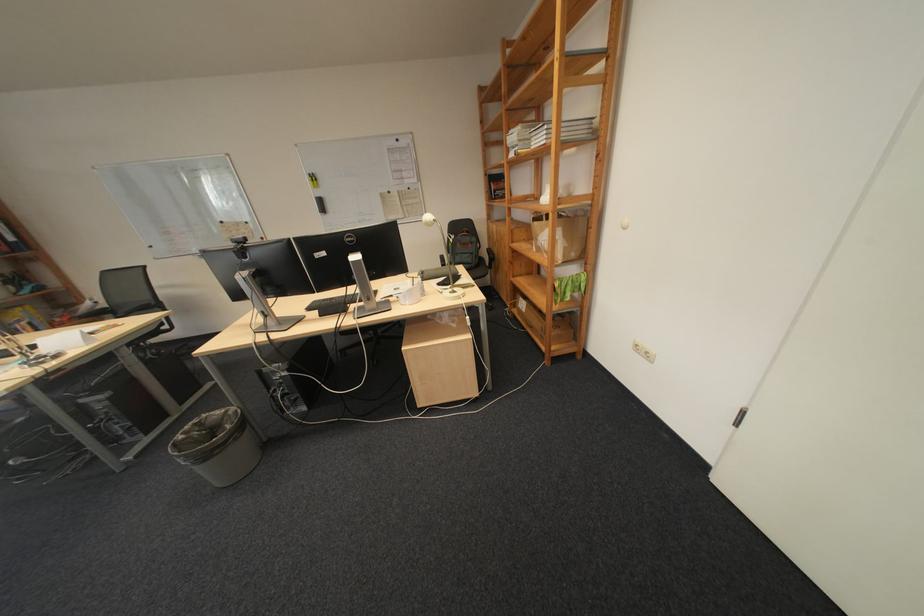
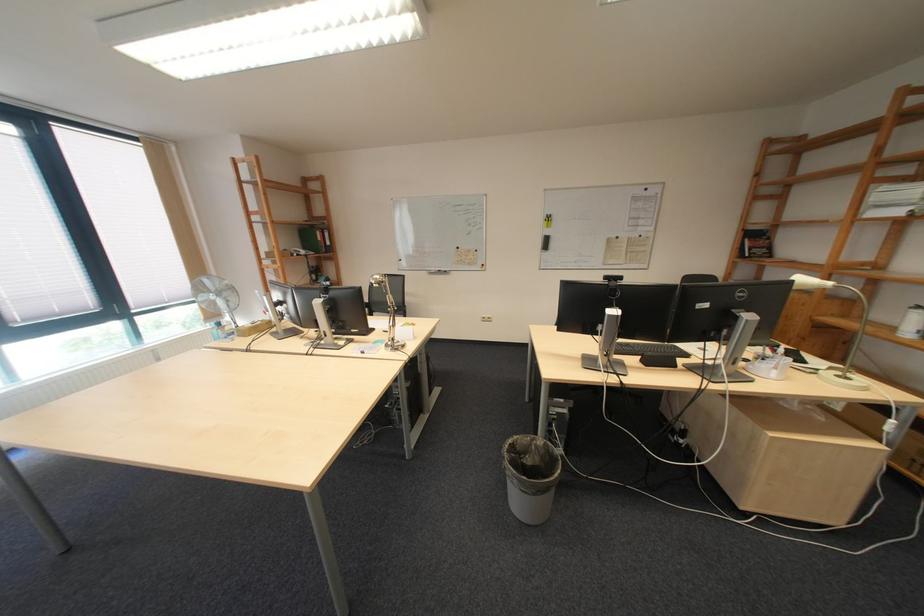
In the second image, find the point that corresponds to point (465, 293) in the first image.

(853, 378)